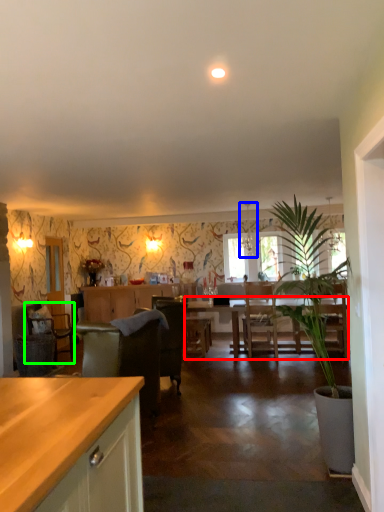
Question: Estimate the real-world distances between objects in this image. Which object is farther from kitchen & dining room table (highlighted by a red box), lamp (highlighted by a blue box) or chair (highlighted by a green box)?

Choices:
 (A) lamp
 (B) chair

Answer: (B)